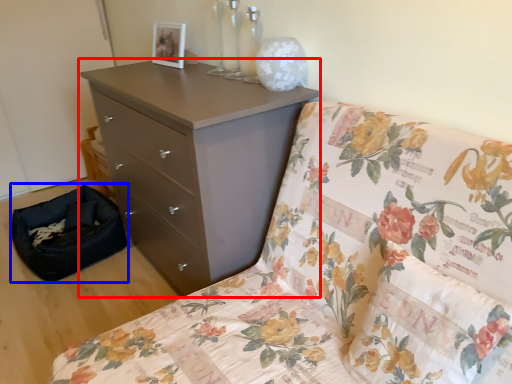
Question: Which point is further to the camera, chest of drawers (highlighted by a red box) or footrest (highlighted by a blue box)?

Choices:
 (A) chest of drawers
 (B) footrest

Answer: (B)